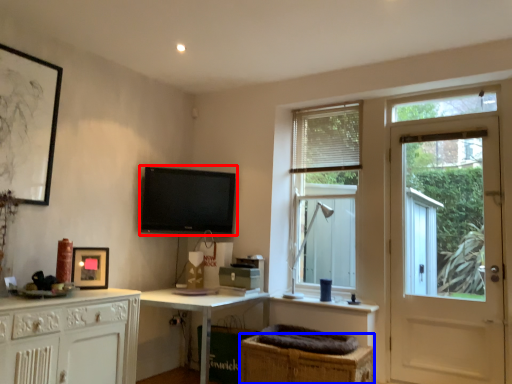
Question: Which object appears closest to the camera in this image, television (highlighted by a red box) or cabinetry (highlighted by a blue box)?

Choices:
 (A) television
 (B) cabinetry

Answer: (B)